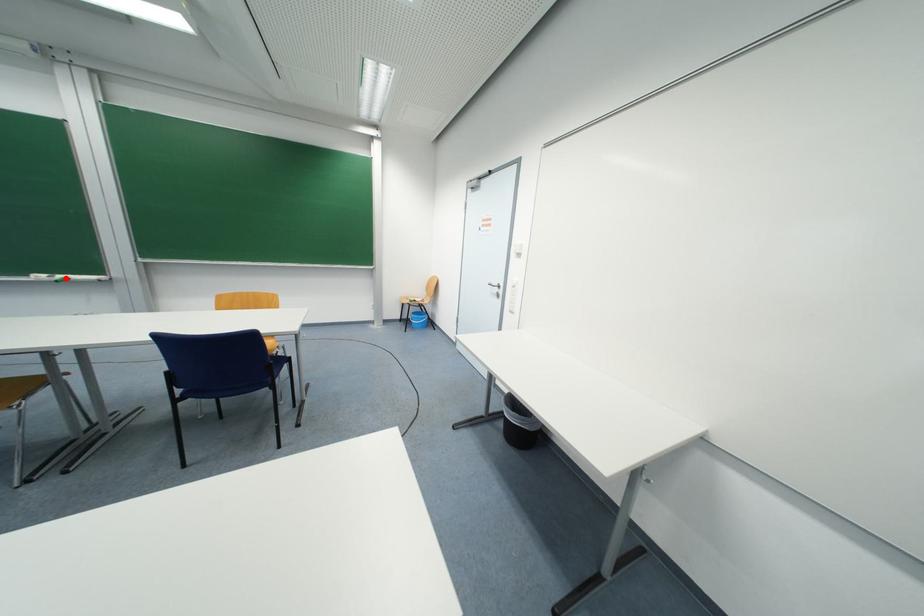
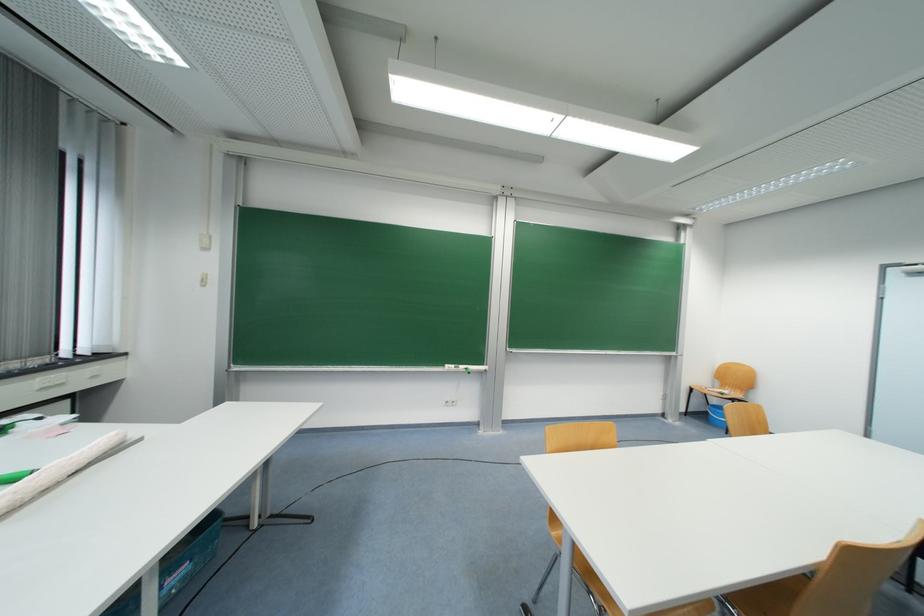
Where in the second image is the point corresponding to the highlighted location from the first image?

(467, 369)